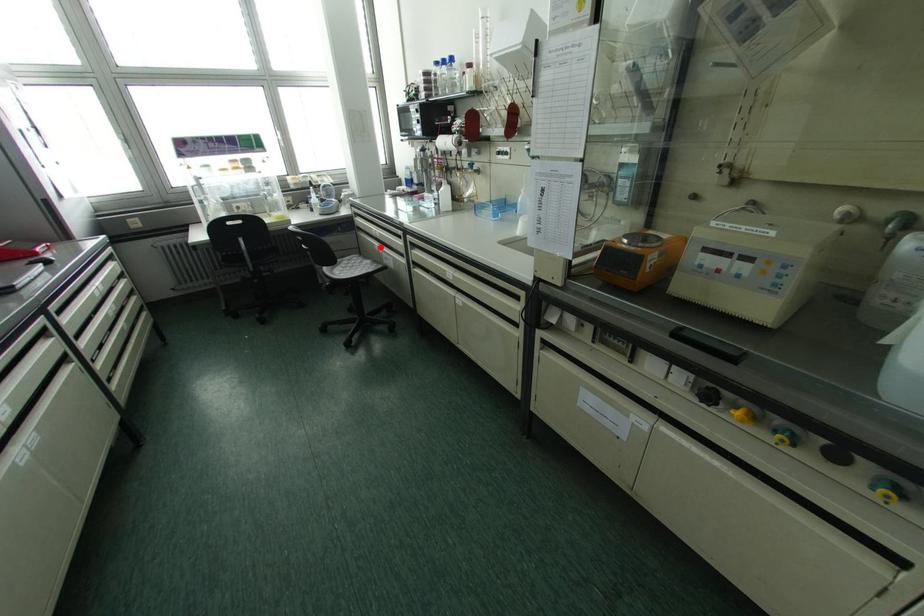
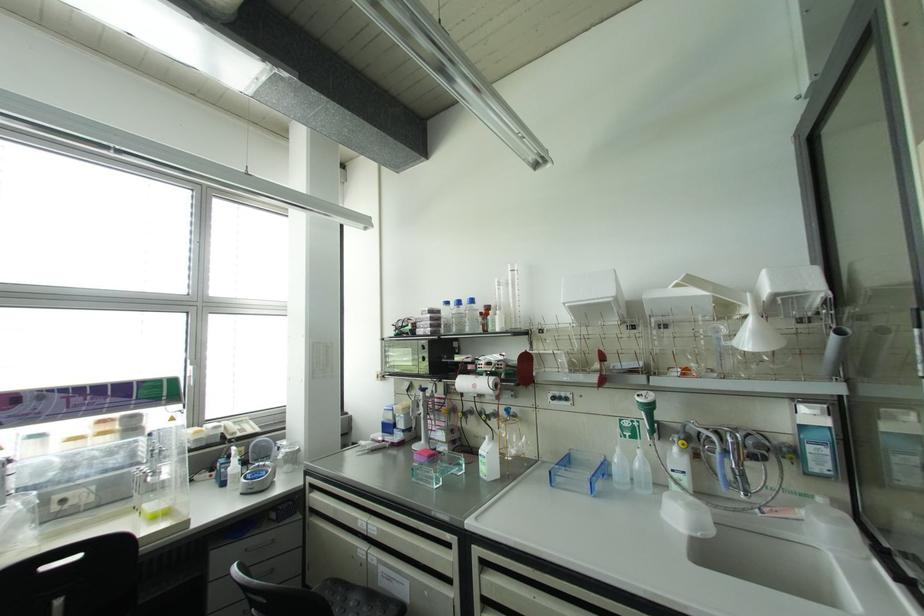
Question: I am providing you with two images of the same scene from different viewpoints. A red point is marked on the first image. Can you still see the location of the red point in image 2?

Choices:
 (A) Yes
 (B) No

Answer: (A)